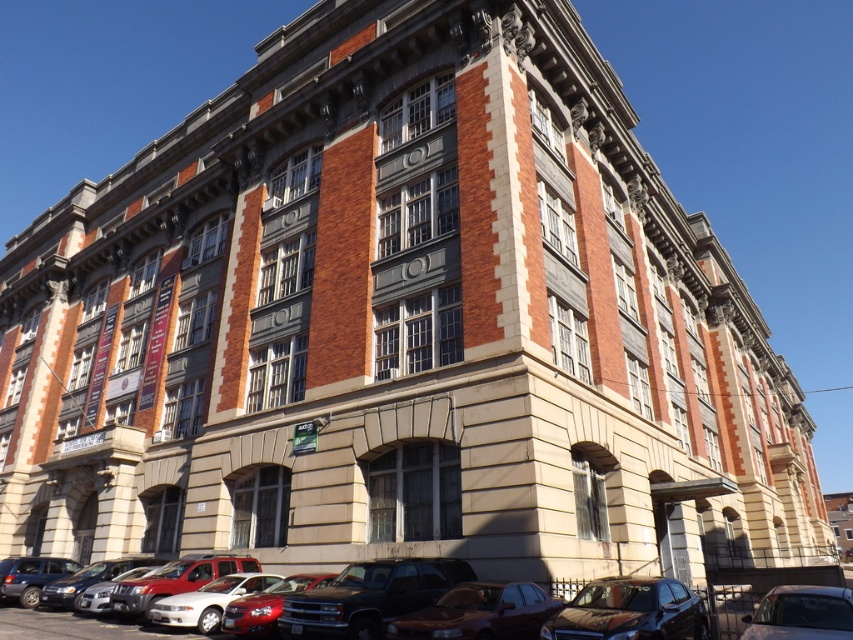
You are a delivery person trying to park your 1.8 meters tall package next to the shiny black sedan at lower center and the satin brown sedan at lower center. Which sedan should you place the package next to if you want it to be as tall as the sedan?

The shiny black sedan at lower center is much taller than the satin brown sedan at lower center, so you should place the package next to the shiny black sedan at lower center to match its height.

You are a pedestrian standing on the sidewalk in front of the multi story building. You see a satin brown sedan at lower center and a matte black suv at lower left. Which vehicle is closer to you?

The satin brown sedan at lower center is closer to you because it is in front of the matte black suv at lower left.